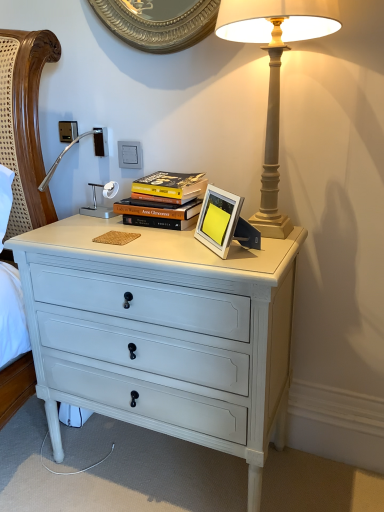
Where is `free space in front of hardcover books at center`? free space in front of hardcover books at center is located at coordinates (155, 238).